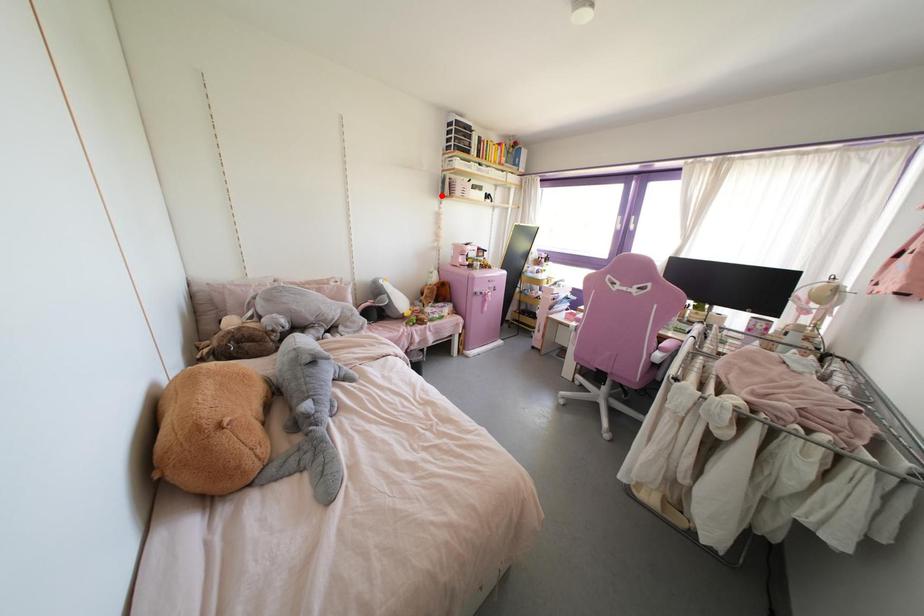
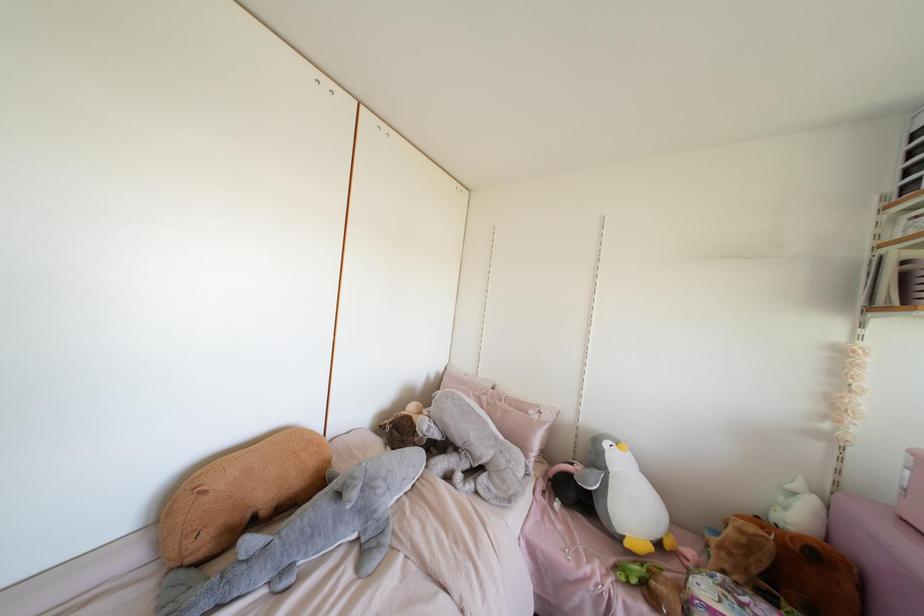
Question: I am providing you with two images of the same scene from different viewpoints. Given a red point in image1, look at the same physical point in image2. Is it:

Choices:
 (A) Closer to the viewpoint
 (B) Farther from the viewpoint

Answer: (B)